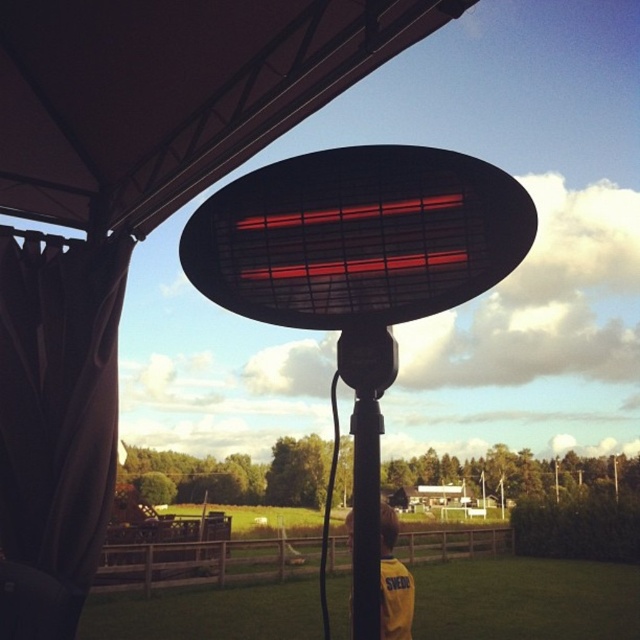
You are a maintenance worker checking the height of the black matte infrared heater at center and the black matte pole at center. Which one is taller?

The black matte infrared heater at center is taller than the black matte pole at center.

You are designing a layout for a small outdoor seating area and want to ensure there is enough space between the black matte infrared heater at center and the black matte pole at center. Given that the heater is wider than the pole, what should you consider when placing them to avoid overcrowding?

Since the black matte infrared heater at center is wider than the black matte pole at center, you should ensure there is sufficient horizontal space between them to accommodate the heater. Place the pole closer to a wall or corner so the heater can be positioned away from it, allowing enough room for the heater to function safely and comfortably without feeling cramped.